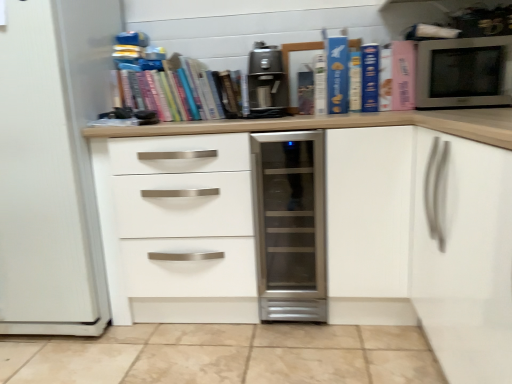
Question: From a real-world perspective, is blue matte book at upper center, acting as the fifth paperback book starting from the left, physically located above or below hardcover book at center, arranged as the 6th paperback book when viewed from the right?

Choices:
 (A) below
 (B) above

Answer: (B)

Question: Considering the positions of blue matte book at upper center, which ranks as the 3th paperback book in right-to-left order, and hardcover book at center, which appears as the second paperback book when viewed from the left, in the image, is blue matte book at upper center, which ranks as the 3th paperback book in right-to-left order, taller or shorter than hardcover book at center, which appears as the second paperback book when viewed from the left,?

Choices:
 (A) short
 (B) tall

Answer: (B)

Question: Which of these objects is positioned farthest from the hardcover books at upper center?

Choices:
 (A) satin silver microwave at upper right
 (B) blue matte book at upper center, acting as the fifth paperback book starting from the left
 (C) matte paper at center, which appears as the 1th paperback book when viewed from the left
 (D) pink matte paperback book at upper right, the first paperback book viewed from the right
 (E) hardcover book at center, which appears as the second paperback book when viewed from the left

Answer: (A)

Question: Which object is the farthest from the pink matte book at upper right, the second paperback book when ordered from right to left?

Choices:
 (A) satin silver microwave at upper right
 (B) white matte drawer at center
 (C) pink matte paperback book at upper right, the first paperback book viewed from the right
 (D) matte paper at center, which appears as the 1th paperback book when viewed from the left
 (E) hardcover books at upper center

Answer: (B)